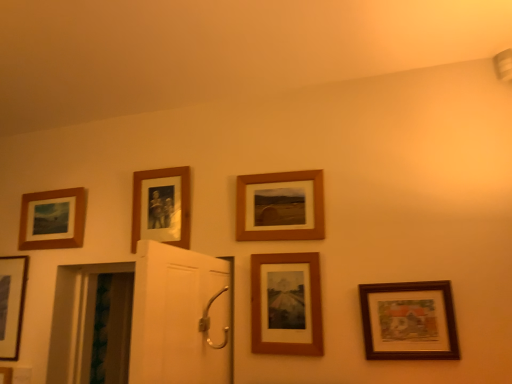
Question: Considering the relative sizes of matte black picture frame at lower left, the 6th picture frame positioned from the right, and wooden picture frame at lower right, positioned as the sixth picture frame in left-to-right order, in the image provided, is matte black picture frame at lower left, the 6th picture frame positioned from the right, shorter than wooden picture frame at lower right, positioned as the sixth picture frame in left-to-right order,?

Choices:
 (A) yes
 (B) no

Answer: (B)

Question: Considering the relative positions of matte black picture frame at lower left, the 6th picture frame positioned from the right, and wooden picture frame at lower right, positioned as the sixth picture frame in left-to-right order, in the image provided, is matte black picture frame at lower left, the 6th picture frame positioned from the right, to the right of wooden picture frame at lower right, positioned as the sixth picture frame in left-to-right order, from the viewer's perspective?

Choices:
 (A) no
 (B) yes

Answer: (A)

Question: From the image's perspective, is matte black picture frame at lower left, the 1th picture frame from the left, beneath wooden picture frame at lower right, acting as the 1th picture frame starting from the right?

Choices:
 (A) yes
 (B) no

Answer: (A)

Question: Could you tell me if matte black picture frame at lower left, the 6th picture frame positioned from the right, is turned towards wooden picture frame at lower right, acting as the 1th picture frame starting from the right?

Choices:
 (A) no
 (B) yes

Answer: (A)

Question: Is matte black picture frame at lower left, the 6th picture frame positioned from the right, further to camera compared to wooden picture frame at lower right, acting as the 1th picture frame starting from the right?

Choices:
 (A) no
 (B) yes

Answer: (B)

Question: From a real-world perspective, is wooden picture frame at lower right, acting as the 1th picture frame starting from the right, above or below matte wood picture frame at upper left, which is counted as the fifth picture frame, starting from the right?

Choices:
 (A) below
 (B) above

Answer: (A)

Question: Considering the relative positions of wooden picture frame at lower right, positioned as the sixth picture frame in left-to-right order, and matte wood picture frame at upper left, which is the 2th picture frame in left-to-right order, in the image provided, is wooden picture frame at lower right, positioned as the sixth picture frame in left-to-right order, to the left or to the right of matte wood picture frame at upper left, which is the 2th picture frame in left-to-right order,?

Choices:
 (A) right
 (B) left

Answer: (A)

Question: Considering the positions of wooden picture frame at lower right, positioned as the sixth picture frame in left-to-right order, and matte wood picture frame at upper left, which is the 2th picture frame in left-to-right order, in the image, is wooden picture frame at lower right, positioned as the sixth picture frame in left-to-right order, taller or shorter than matte wood picture frame at upper left, which is the 2th picture frame in left-to-right order,?

Choices:
 (A) tall
 (B) short

Answer: (B)

Question: Is wooden picture frame at lower right, acting as the 1th picture frame starting from the right, inside or outside of matte wood picture frame at upper left, which is counted as the fifth picture frame, starting from the right?

Choices:
 (A) inside
 (B) outside

Answer: (B)

Question: Is wooden photo frame at upper center, arranged as the 4th picture frame when viewed from the right, to the left or to the right of matte wood picture frame at upper left, which is the 2th picture frame in left-to-right order, in the image?

Choices:
 (A) left
 (B) right

Answer: (B)

Question: In terms of width, does wooden photo frame at upper center, arranged as the 4th picture frame when viewed from the right, look wider or thinner when compared to matte wood picture frame at upper left, which is counted as the fifth picture frame, starting from the right?

Choices:
 (A) wide
 (B) thin

Answer: (A)

Question: Is wooden photo frame at upper center, which ranks as the third picture frame in left-to-right order, in front of or behind matte wood picture frame at upper left, which is the 2th picture frame in left-to-right order, in the image?

Choices:
 (A) behind
 (B) front

Answer: (B)

Question: Does point (170, 170) appear closer or farther from the camera than point (24, 248)?

Choices:
 (A) farther
 (B) closer

Answer: (B)

Question: Considering the positions of wooden picture frame at lower right, acting as the 1th picture frame starting from the right, and wooden photo frame at upper center, which ranks as the third picture frame in left-to-right order, in the image, is wooden picture frame at lower right, acting as the 1th picture frame starting from the right, taller or shorter than wooden photo frame at upper center, which ranks as the third picture frame in left-to-right order,?

Choices:
 (A) tall
 (B) short

Answer: (B)

Question: Considering their positions, is wooden picture frame at lower right, positioned as the sixth picture frame in left-to-right order, located in front of or behind wooden photo frame at upper center, arranged as the 4th picture frame when viewed from the right?

Choices:
 (A) behind
 (B) front

Answer: (B)